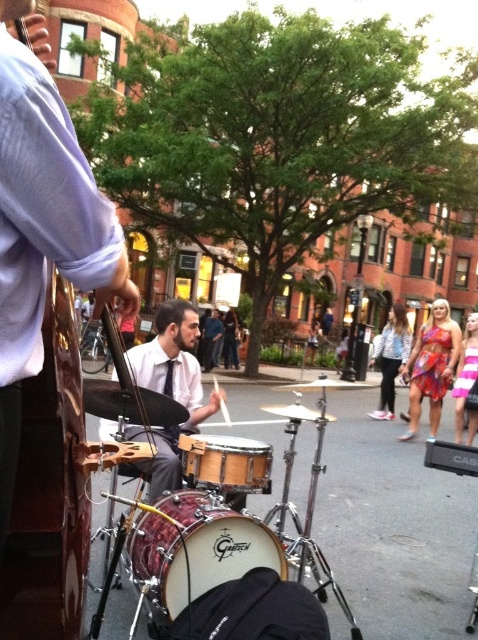
Question: Which point is closer to the camera?

Choices:
 (A) pos(474,339)
 (B) pos(218,513)
 (C) pos(387,344)
 (D) pos(434,388)

Answer: (B)

Question: Does floral dress at center have a lesser width compared to pink striped dress at lower right?

Choices:
 (A) no
 (B) yes

Answer: (B)

Question: In this image, where is matte white shirt at center located relative to wooden drum at center?

Choices:
 (A) above
 (B) below

Answer: (A)

Question: Which object is positioned farthest from the denim jacket at center?

Choices:
 (A) wooden drum at center
 (B) pink striped dress at lower right
 (C) floral dress at center

Answer: (A)

Question: Estimate the real-world distances between objects in this image. Which object is closer to the wooden drum at center?

Choices:
 (A) matte white shirt at center
 (B) denim jacket at center
 (C) red lacquered drum at center

Answer: (C)

Question: Does floral dress at center come in front of denim jacket at center?

Choices:
 (A) yes
 (B) no

Answer: (A)